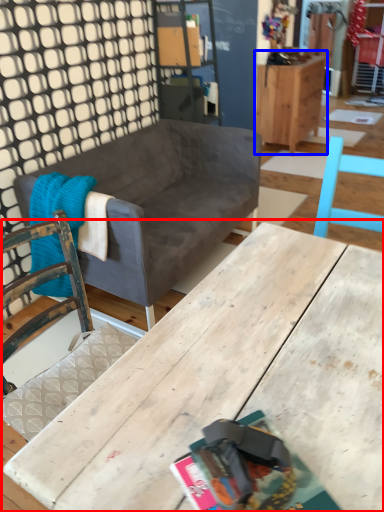
Question: Which object appears closest to the camera in this image, table (highlighted by a red box) or cabinetry (highlighted by a blue box)?

Choices:
 (A) table
 (B) cabinetry

Answer: (A)